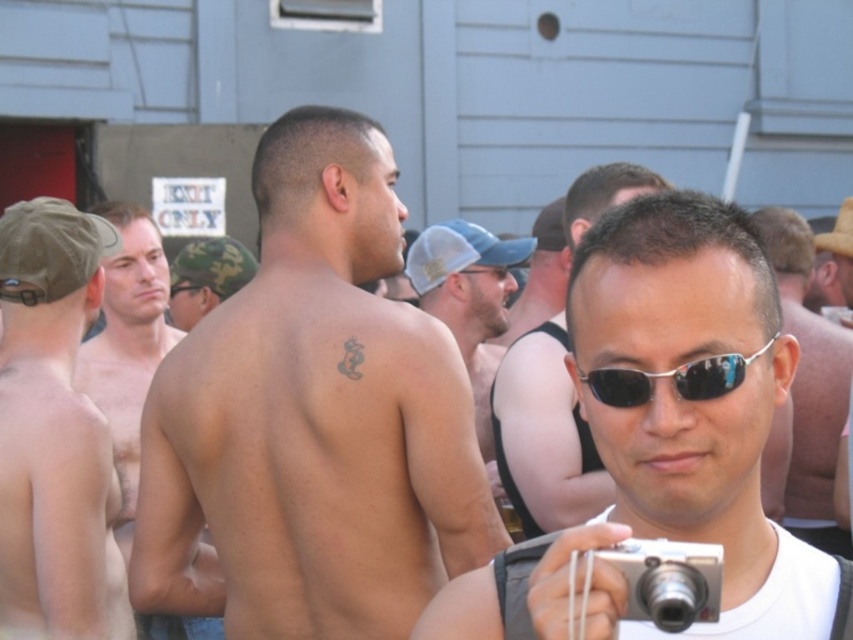
Question: Among these objects, which one is nearest to the camera?

Choices:
 (A) black ink snake at back
 (B) white matte sunglasses at center
 (C) hairless skin at left

Answer: (A)

Question: Is sunglasses at center thinner than hairless skin at left?

Choices:
 (A) yes
 (B) no

Answer: (A)

Question: Is skinny white man at left positioned in front of silver metallic camera at lower right?

Choices:
 (A) yes
 (B) no

Answer: (B)

Question: Which point appears farthest from the camera in this image?

Choices:
 (A) (590, 179)
 (B) (123, 205)
 (C) (793, 218)

Answer: (C)

Question: Can you confirm if skinny white man at left is smaller than camouflage hat at center?

Choices:
 (A) yes
 (B) no

Answer: (B)

Question: Estimate the real-world distances between objects in this image. Which object is closer to the sunglasses at center?

Choices:
 (A) black ink snake at back
 (B) skinny white man at left

Answer: (A)